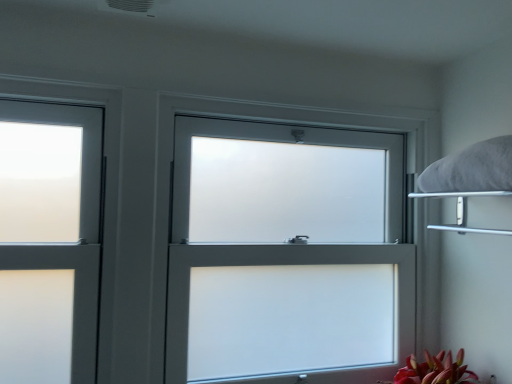
Question: Can you confirm if white fluffy pillow at upper right is bigger than white frosted glass window at center?

Choices:
 (A) yes
 (B) no

Answer: (B)

Question: Is white frosted glass window at center inside white fluffy pillow at upper right?

Choices:
 (A) yes
 (B) no

Answer: (B)

Question: Considering the relative sizes of white fluffy pillow at upper right and white frosted glass window at center in the image provided, is white fluffy pillow at upper right taller than white frosted glass window at center?

Choices:
 (A) yes
 (B) no

Answer: (B)

Question: Is the depth of white fluffy pillow at upper right greater than that of white frosted glass window at center?

Choices:
 (A) yes
 (B) no

Answer: (B)

Question: Considering the relative positions of white fluffy pillow at upper right and white frosted glass window at center in the image provided, is white fluffy pillow at upper right to the right of white frosted glass window at center from the viewer's perspective?

Choices:
 (A) yes
 (B) no

Answer: (A)

Question: Is white fluffy pillow at upper right aimed at white frosted glass window at center?

Choices:
 (A) no
 (B) yes

Answer: (A)

Question: From a real-world perspective, does white frosted glass window at center sit lower than metallic silver shelf at upper right?

Choices:
 (A) no
 (B) yes

Answer: (B)

Question: From the image's perspective, is white frosted glass window at center over metallic silver shelf at upper right?

Choices:
 (A) yes
 (B) no

Answer: (B)

Question: Is the position of white frosted glass window at center less distant than that of metallic silver shelf at upper right?

Choices:
 (A) yes
 (B) no

Answer: (B)

Question: Is white frosted glass window at center wider than metallic silver shelf at upper right?

Choices:
 (A) no
 (B) yes

Answer: (A)

Question: Is white frosted glass window at center taller than metallic silver shelf at upper right?

Choices:
 (A) yes
 (B) no

Answer: (A)

Question: Would you consider white frosted glass window at center to be distant from metallic silver shelf at upper right?

Choices:
 (A) no
 (B) yes

Answer: (A)

Question: Does white fluffy pillow at upper right appear on the right side of metallic silver shelf at upper right?

Choices:
 (A) no
 (B) yes

Answer: (B)